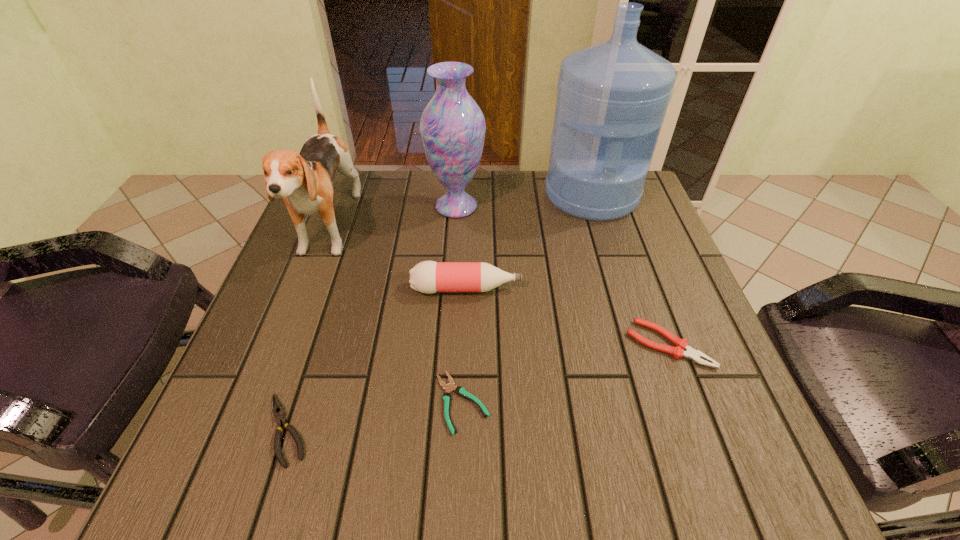
Image resolution: width=960 pixels, height=540 pixels. I want to click on free space located on the side of the tallest object with the handle, so click(643, 361).

Locate an element on the screen. vacant region located on the left of the vase is located at coordinates (319, 206).

At what (x,y) coordinates should I click in order to perform the action: click on free space located at the face of the puppy. Please return your answer as a coordinate pair (x, y). The height and width of the screenshot is (540, 960). Looking at the image, I should click on (299, 307).

Locate an element on the screen. vacant space located with the cap open on the bottle is located at coordinates (669, 289).

Locate an element on the screen. This screenshot has height=540, width=960. vacant space located on the front of the tallest pliers is located at coordinates (705, 442).

Identify the location of vacant area located 0.340m on the back of the leftmost pliers. The width and height of the screenshot is (960, 540). (342, 259).

At what (x,y) coordinates should I click in order to perform the action: click on free point located 0.270m on the right of the second pliers from right to left. Please return your answer as a coordinate pair (x, y). The width and height of the screenshot is (960, 540). Looking at the image, I should click on coord(651,402).

You are a GUI agent. You are given a task and a screenshot of the screen. Output one action in this format:
    pyautogui.click(x=<x>, y=<y>)
    Task: Click on the water jug located at the far edge
    The image size is (960, 540).
    Given the screenshot: What is the action you would take?
    pyautogui.click(x=612, y=97)

This screenshot has width=960, height=540. Identify the location of vase that is at the far edge. (452, 126).

I want to click on puppy located in the far edge section of the desktop, so click(304, 180).